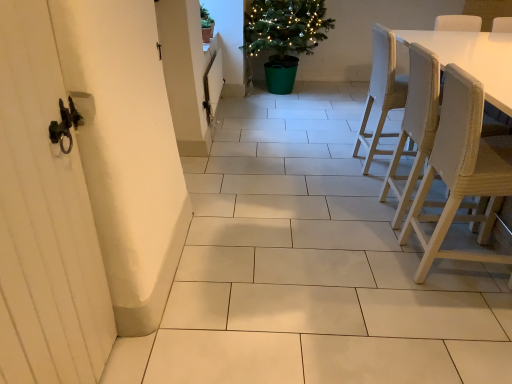
Question: Should I look upward or downward to see green plastic potted plant at upper center, placed as the second houseplant when sorted from left to right?

Choices:
 (A) down
 (B) up

Answer: (B)

Question: Should I look upward or downward to see green matte pot at upper center, the first houseplant from the front?

Choices:
 (A) down
 (B) up

Answer: (B)

Question: From a real-world perspective, does light brown woven chair at right, which is the second chair from back to front, stand above green plastic potted plant at upper center, which is the 1th houseplant in right-to-left order?

Choices:
 (A) no
 (B) yes

Answer: (A)

Question: From the image's perspective, would you say light brown woven chair at right, which is counted as the 2th chair, starting from the front, is shown under green plastic potted plant at upper center, which is the 1th houseplant in right-to-left order?

Choices:
 (A) no
 (B) yes

Answer: (B)

Question: Considering the relative positions of light brown woven chair at right, which is counted as the 2th chair, starting from the front, and green plastic potted plant at upper center, placed as the second houseplant when sorted from left to right, in the image provided, is light brown woven chair at right, which is counted as the 2th chair, starting from the front, to the right of green plastic potted plant at upper center, placed as the second houseplant when sorted from left to right, from the viewer's perspective?

Choices:
 (A) yes
 (B) no

Answer: (A)

Question: Is light brown woven chair at right, which is the second chair from back to front, completely or partially outside of green plastic potted plant at upper center, which is the 1th houseplant in right-to-left order?

Choices:
 (A) yes
 (B) no

Answer: (A)

Question: Is light brown woven chair at right, which is the second chair from back to front, shorter than green plastic potted plant at upper center, placed as the second houseplant when sorted from left to right?

Choices:
 (A) no
 (B) yes

Answer: (B)

Question: Is light brown woven chair at right, which is the second chair from back to front, smaller than green plastic potted plant at upper center, placed as the second houseplant when sorted from left to right?

Choices:
 (A) no
 (B) yes

Answer: (B)

Question: From a real-world perspective, is light brown woven chair at right, which is counted as the 2th chair, starting from the front, positioned under woven wood chair at right, marked as the 1th chair in a front-to-back arrangement, based on gravity?

Choices:
 (A) no
 (B) yes

Answer: (A)

Question: Considering the relative sizes of light brown woven chair at right, which is the second chair from back to front, and woven wood chair at right, marked as the 1th chair in a front-to-back arrangement, in the image provided, is light brown woven chair at right, which is the second chair from back to front, shorter than woven wood chair at right, marked as the 1th chair in a front-to-back arrangement,?

Choices:
 (A) yes
 (B) no

Answer: (B)

Question: Is there a large distance between light brown woven chair at right, which is counted as the 2th chair, starting from the front, and woven wood chair at right, the third chair in the back-to-front sequence?

Choices:
 (A) no
 (B) yes

Answer: (A)

Question: Is light brown woven chair at right, which is the second chair from back to front, behind woven wood chair at right, marked as the 1th chair in a front-to-back arrangement?

Choices:
 (A) no
 (B) yes

Answer: (B)

Question: Does light brown woven chair at right, which is the second chair from back to front, appear on the right side of woven wood chair at right, marked as the 1th chair in a front-to-back arrangement?

Choices:
 (A) no
 (B) yes

Answer: (B)

Question: Is light brown woven chair at right, which is counted as the 2th chair, starting from the front, facing towards woven wood chair at right, marked as the 1th chair in a front-to-back arrangement?

Choices:
 (A) yes
 (B) no

Answer: (B)

Question: From the image's perspective, would you say white wooden screen door at left is shown under light brown woven chair at right, which is counted as the 2th chair, starting from the front?

Choices:
 (A) no
 (B) yes

Answer: (B)